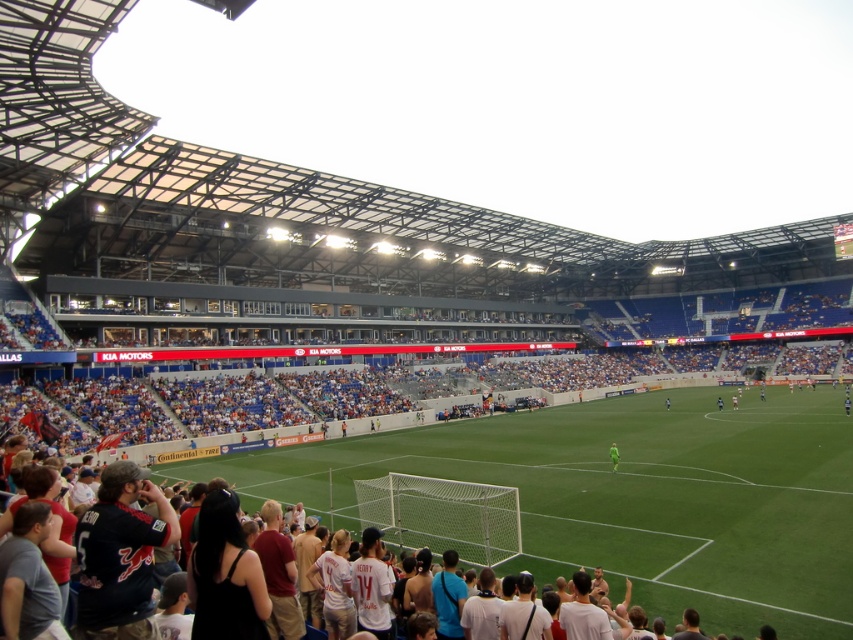
You are a soccer player standing on the field and see the green jersey at center. Which direction should you move to reach the green grass football field at lower center?

The green grass football field at lower center is to the left of the green jersey at center, so you should move to the left to reach it.